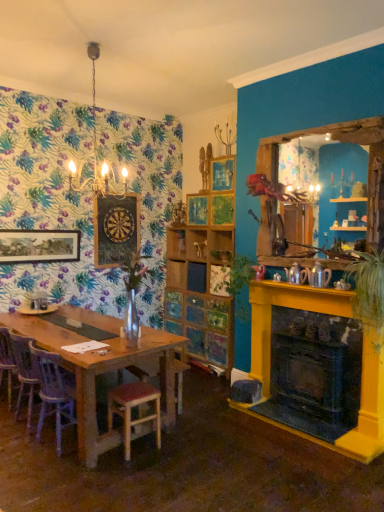
Find the location of `free space in front of wooden at left, which is the 2th chair in back-to-front order`. free space in front of wooden at left, which is the 2th chair in back-to-front order is located at coordinates click(x=52, y=481).